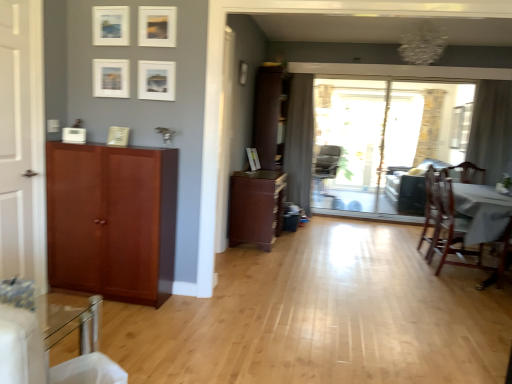
Image resolution: width=512 pixels, height=384 pixels. Describe the element at coordinates (111, 78) in the screenshot. I see `white matte picture frame at upper center, positioned as the first picture frame in left-to-right order` at that location.

What do you see at coordinates (267, 112) in the screenshot?
I see `brown wood cabinet at center, acting as the first cabinetry starting from the back` at bounding box center [267, 112].

Image resolution: width=512 pixels, height=384 pixels. What do you see at coordinates (118, 136) in the screenshot?
I see `white matte picture frame at upper center, placed as the 4th picture frame when sorted from front to back` at bounding box center [118, 136].

Measure the distance between white matte picture frame at upper center, the fourth picture frame viewed from the back, and camera.

A distance of 2.89 meters exists between white matte picture frame at upper center, the fourth picture frame viewed from the back, and camera.

In order to click on white matte picture frame at upper center, the 2th picture frame in the back-to-front sequence in this screenshot , I will do `click(243, 73)`.

Find the location of a particular element. The width and height of the screenshot is (512, 384). couch directly beneath the wooden chair at right, positioned as the first chair in front-to-back order (from a real-world perspective) is located at coordinates (410, 188).

In terms of height, does dark brown leather couch at center look taller or shorter compared to wooden chair at right, positioned as the first chair in front-to-back order?

dark brown leather couch at center is shorter than wooden chair at right, positioned as the first chair in front-to-back order.

Which object is positioned more to the left, dark brown leather couch at center or wooden chair at right, the third chair viewed from the back?

wooden chair at right, the third chair viewed from the back.

Is glossy wood cabinet at left, which is counted as the 1th cabinetry, starting from the front, looking in the opposite direction of white matte picture frame at upper center, the 2th picture frame in the back-to-front sequence?

Correct, glossy wood cabinet at left, which is counted as the 1th cabinetry, starting from the front, is looking away from white matte picture frame at upper center, the 2th picture frame in the back-to-front sequence.

Is glossy wood cabinet at left, the 3th cabinetry when ordered from right to left, placed right next to white matte picture frame at upper center, which is counted as the second picture frame, starting from the right?

No, glossy wood cabinet at left, the 3th cabinetry when ordered from right to left, is not in contact with white matte picture frame at upper center, which is counted as the second picture frame, starting from the right.

From the image's perspective, between glossy wood cabinet at left, the 3th cabinetry when ordered from right to left, and white matte picture frame at upper center, the 2th picture frame in the back-to-front sequence, which one is located above?

white matte picture frame at upper center, the 2th picture frame in the back-to-front sequence, appears higher in the image.

Could you measure the distance between glossy wood cabinet at left, which is the 3th cabinetry from back to front, and white matte picture frame at upper center, the 2th picture frame in the back-to-front sequence?

The distance of glossy wood cabinet at left, which is the 3th cabinetry from back to front, from white matte picture frame at upper center, the 2th picture frame in the back-to-front sequence, is 2.12 meters.

Is transparent glass sliding door at center, which ranks as the 1th window screen in left-to-right order, oriented towards clear glass window screen at right, which appears as the second window screen when viewed from the left?

No, transparent glass sliding door at center, which ranks as the 1th window screen in left-to-right order, is not turned towards clear glass window screen at right, which appears as the second window screen when viewed from the left.

Based on their sizes in the image, would you say transparent glass sliding door at center, the 1th window screen in the front-to-back sequence, is bigger or smaller than clear glass window screen at right, which appears as the 1th window screen when viewed from the right?

transparent glass sliding door at center, the 1th window screen in the front-to-back sequence, is bigger than clear glass window screen at right, which appears as the 1th window screen when viewed from the right.

Is point (459, 111) positioned behind point (470, 111)?

Yes, point (459, 111) is behind point (470, 111).

How different are the orientations of transparent glass sliding door at center, the 1th window screen in the front-to-back sequence, and clear glass window screen at right, which appears as the 1th window screen when viewed from the right, in degrees?

The angle between the facing direction of transparent glass sliding door at center, the 1th window screen in the front-to-back sequence, and the facing direction of clear glass window screen at right, which appears as the 1th window screen when viewed from the right, is 90 degrees.

From a real-world perspective, who is located higher, brown wood cabinet at center, the 2th cabinetry when ordered from right to left, or gray fabric curtain at center, the 2th curtain when ordered from front to back?

From a 3D spatial view, gray fabric curtain at center, the 2th curtain when ordered from front to back, is above.

Is brown wood cabinet at center, the 2th cabinetry when ordered from right to left, oriented towards gray fabric curtain at center, the 2th curtain when ordered from front to back?

No, brown wood cabinet at center, the 2th cabinetry when ordered from right to left, is not facing towards gray fabric curtain at center, the 2th curtain when ordered from front to back.

What's the angular difference between brown wood cabinet at center, the 2th cabinetry when ordered from right to left, and gray fabric curtain at center, placed as the 1th curtain when sorted from left to right,'s facing directions?

88.6 degrees.

Which object is closer to the camera, brown wood cabinet at center, which appears as the second cabinetry when viewed from the front, or gray fabric curtain at center, arranged as the first curtain when viewed from the back?

brown wood cabinet at center, which appears as the second cabinetry when viewed from the front.

Which object is further away from the camera, wooden chair at right, positioned as the 2th chair in back-to-front order, or matte white picture frame at upper center, the 7th picture frame when ordered from back to front?

wooden chair at right, positioned as the 2th chair in back-to-front order, is further from the camera.

You are a GUI agent. You are given a task and a screenshot of the screen. Output one action in this format:
    pyautogui.click(x=<x>, y=<y>)
    Task: Click on the 5th picture frame above the wooden chair at right, positioned as the 2th chair in back-to-front order (from the image's perspective)
    The image size is (512, 384).
    Given the screenshot: What is the action you would take?
    pyautogui.click(x=157, y=26)

In terms of width, does wooden chair at right, positioned as the second chair in front-to-back order, look wider or thinner when compared to matte white picture frame at upper center, positioned as the 1th picture frame in front-to-back order?

In the image, wooden chair at right, positioned as the second chair in front-to-back order, appears to be wider than matte white picture frame at upper center, positioned as the 1th picture frame in front-to-back order.

From the picture: Would you say brown wood cabinet at center, marked as the third cabinetry in a left-to-right arrangement, is part of transparent glass sliding door at center, the 1th window screen in the front-to-back sequence,'s contents?

No.

Is point (387, 205) positioned behind point (266, 65)?

Yes, it is behind point (266, 65).

Is transparent glass sliding door at center, the second window screen in the back-to-front sequence, aimed at brown wood cabinet at center, acting as the 3th cabinetry starting from the front?

No.

Does transparent glass sliding door at center, the second window screen in the back-to-front sequence, have a larger size compared to brown wood cabinet at center, marked as the third cabinetry in a left-to-right arrangement?

No.

Looking at this image, measure the distance from wooden chair at right, the third chair viewed from the back, to matte white picture frame at upper center, the 4th picture frame from the left.

wooden chair at right, the third chair viewed from the back, is 9.23 feet away from matte white picture frame at upper center, the 4th picture frame from the left.

Would you say wooden chair at right, positioned as the first chair in front-to-back order, contains matte white picture frame at upper center, the fourth picture frame in the right-to-left sequence?

No, matte white picture frame at upper center, the fourth picture frame in the right-to-left sequence, is located outside of wooden chair at right, positioned as the first chair in front-to-back order.

Which is behind, point (447, 246) or point (170, 81)?

The point (447, 246) is more distant.

Where is `the 2nd chair below the dark brown leather couch at center (from the image's perspective)`? the 2nd chair below the dark brown leather couch at center (from the image's perspective) is located at coordinates (446, 223).

Starting from the white matte picture frame at upper center, the 2th picture frame in the back-to-front sequence, which cabinetry is the 2nd one in front? Please provide its 2D coordinates.

[(112, 220)]

Which object lies further to the anchor point white matte picture frame at upper center, which is the seventh picture frame in right-to-left order, brown wood cabinet at center, acting as the 3th cabinetry starting from the front, or clear glass window screen at right, which appears as the 1th window screen when viewed from the right?

clear glass window screen at right, which appears as the 1th window screen when viewed from the right, is further to white matte picture frame at upper center, which is the seventh picture frame in right-to-left order.

Estimate the real-world distances between objects in this image. Which object is further from sheer fabric curtain at right, marked as the 2th curtain in a back-to-front arrangement, white matte picture frame at upper center, the fourth picture frame viewed from the back, or gray fabric chair at center, which appears as the 1th chair when viewed from the back?

The object further to sheer fabric curtain at right, marked as the 2th curtain in a back-to-front arrangement, is white matte picture frame at upper center, the fourth picture frame viewed from the back.

Looking at the image, which one is located closer to matte white picture frame at upper center, acting as the 5th picture frame starting from the left, wooden chair at right, positioned as the 2th chair in back-to-front order, or clear glass window screen at right, positioned as the second window screen in front-to-back order?

wooden chair at right, positioned as the 2th chair in back-to-front order, lies closer to matte white picture frame at upper center, acting as the 5th picture frame starting from the left, than the other object.

Which object lies further to the anchor point brown wood cabinet at center, acting as the 3th cabinetry starting from the front, sheer fabric curtain at right, marked as the first curtain in a right-to-left arrangement, or matte white picture frame at upper center, which is counted as the 3th picture frame, starting from the front?

sheer fabric curtain at right, marked as the first curtain in a right-to-left arrangement.

Which object lies further to the anchor point brown wood cabinet at center, which is the second cabinetry from left to right, wooden chair at right, positioned as the 2th chair in back-to-front order, or wooden chair at right, the third chair viewed from the back?

Among the two, wooden chair at right, positioned as the 2th chair in back-to-front order, is located further to brown wood cabinet at center, which is the second cabinetry from left to right.

Which object lies nearer to the anchor point transparent glass sliding door at center, the 1th window screen in the front-to-back sequence, sheer fabric curtain at right, the 1th curtain viewed from the front, or gray fabric curtain at center, placed as the 1th curtain when sorted from left to right?

The object closer to transparent glass sliding door at center, the 1th window screen in the front-to-back sequence, is sheer fabric curtain at right, the 1th curtain viewed from the front.

When comparing their distances from dark brown leather couch at center, does brown wood cabinet at center, acting as the first cabinetry starting from the back, or matte white picture frame at upper center, which ranks as the 6th picture frame in right-to-left order, seem further?

The object further to dark brown leather couch at center is matte white picture frame at upper center, which ranks as the 6th picture frame in right-to-left order.

Based on the photo, from the image, which object appears to be nearer to dark brown leather couch at center, glossy wood cabinet at left, positioned as the 1th cabinetry in left-to-right order, or white matte door at left?

The object closer to dark brown leather couch at center is glossy wood cabinet at left, positioned as the 1th cabinetry in left-to-right order.

At what (x,y) coordinates should I click in order to perform the action: click on cabinetry located between white matte door at left and brown wood cabinet at center, which is the second cabinetry from left to right, in the depth direction. Please return your answer as a coordinate pair (x, y). This screenshot has height=384, width=512. Looking at the image, I should click on (112, 220).

Locate an element on the screen. door between white matte picture frame at upper center, marked as the fifth picture frame in a front-to-back arrangement, and glossy wood cabinet at left, which is the 3th cabinetry from back to front, vertically is located at coordinates (22, 143).

Find the location of a particular element. This screenshot has width=512, height=384. couch between matte white picture frame at center, placed as the first picture frame when sorted from back to front, and clear glass window screen at right, which appears as the 1th window screen when viewed from the right, in the horizontal direction is located at coordinates (410, 188).

This screenshot has height=384, width=512. In order to click on window screen located between sheer fabric curtain at right, arranged as the 2th curtain when viewed from the left, and dark brown leather couch at center in the depth direction in this screenshot , I will do `click(385, 137)`.